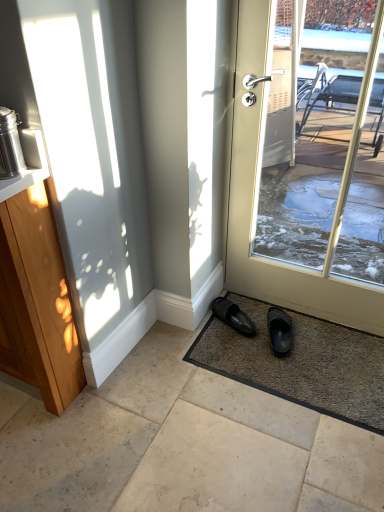
Find the location of a particular element. vacant space in front of wooden cabinet at left is located at coordinates (79, 446).